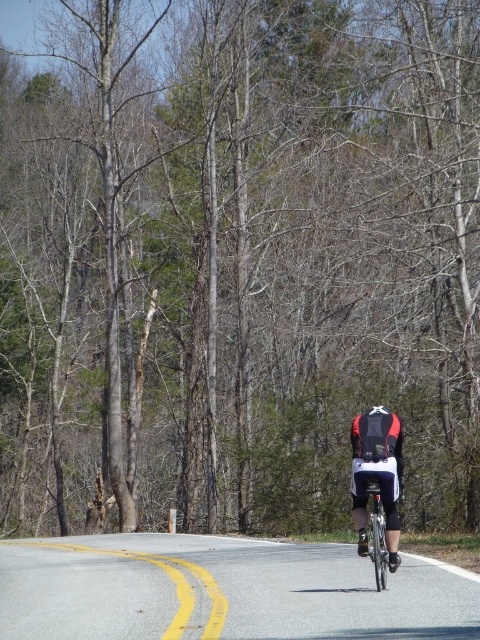
Question: Does red and black cycling jersey at center appear under matte black helmet at center?

Choices:
 (A) yes
 (B) no

Answer: (A)

Question: Considering the relative positions of red and black cycling jersey at center and matte black helmet at center in the image provided, where is red and black cycling jersey at center located with respect to matte black helmet at center?

Choices:
 (A) left
 (B) right

Answer: (A)

Question: Among these points, which one is farthest from the camera?

Choices:
 (A) click(384, 483)
 (B) click(386, 412)

Answer: (B)

Question: In this image, where is red and black cycling jersey at center located relative to matte black helmet at center?

Choices:
 (A) below
 (B) above

Answer: (A)

Question: Which point is farther to the camera?

Choices:
 (A) (372, 404)
 (B) (389, 493)

Answer: (A)